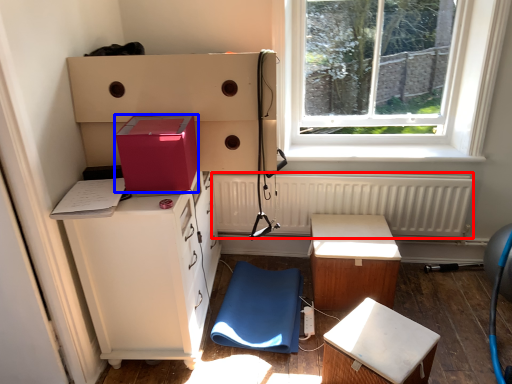
Question: Which of the following is the closest to the observer, radiator (highlighted by a red box) or box (highlighted by a blue box)?

Choices:
 (A) radiator
 (B) box

Answer: (B)